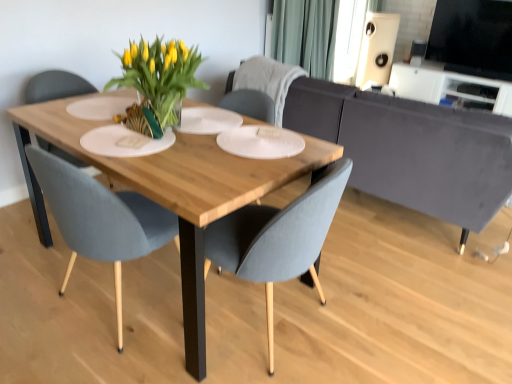
The height and width of the screenshot is (384, 512). I want to click on empty space that is in between matte gray chair at center, marked as the 2th chair in a back-to-front arrangement, and natural wood table at center, so click(72, 285).